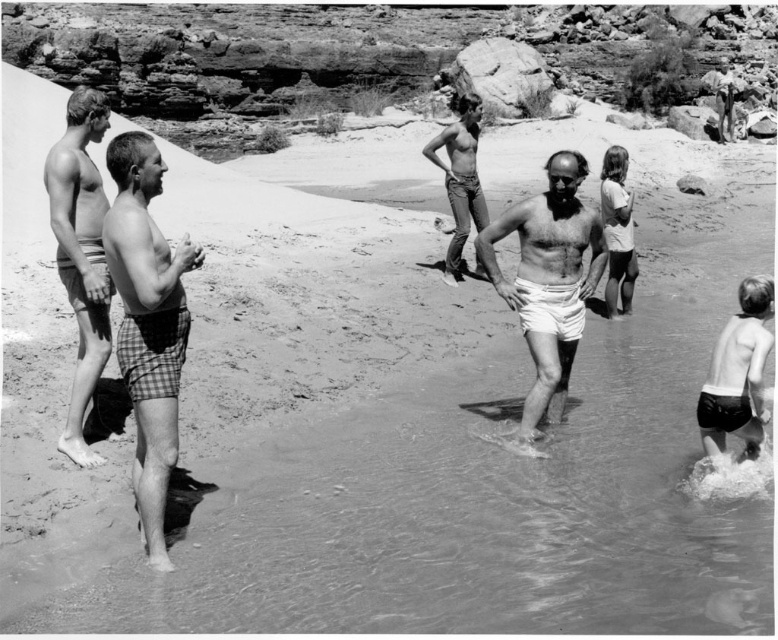
Consider the image. Is white cotton shorts at center above smooth white shorts at left?

No.

Which is in front, point (538, 256) or point (102, 304)?

Positioned in front is point (102, 304).

I want to click on white cotton shorts at center, so click(x=548, y=280).

Describe the element at coordinates (146, 323) in the screenshot. I see `checkered fabric shorts at left` at that location.

Is checkered fabric shorts at left positioned at the back of smooth white shorts at left?

No, checkered fabric shorts at left is in front of smooth white shorts at left.

Find the location of a particular element. The width and height of the screenshot is (778, 640). checkered fabric shorts at left is located at coordinates (146, 323).

Does point (559, 252) lie in front of point (622, 259)?

That is True.

Between white cotton shorts at center and smooth white shirt at upper right, which one has less height?

Standing shorter between the two is smooth white shirt at upper right.

I want to click on white cotton shorts at center, so click(548, 280).